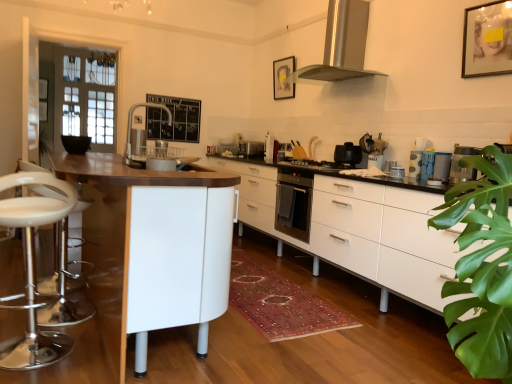
In order to click on vacant space behind satin nickel faucet at center in this screenshot , I will do `click(151, 150)`.